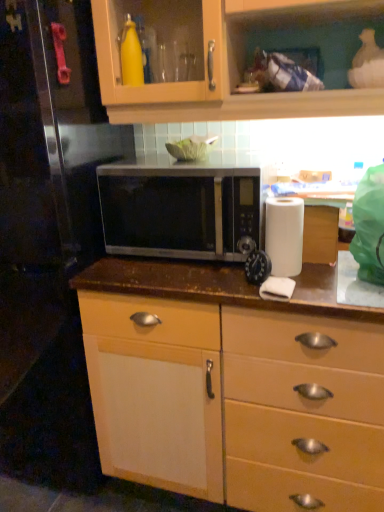
What do you see at coordinates (284, 234) in the screenshot? I see `white matte paper towel at right` at bounding box center [284, 234].

Describe the element at coordinates (233, 388) in the screenshot. The image size is (384, 512). I see `brown polished wood countertop at center` at that location.

This screenshot has width=384, height=512. What do you see at coordinates (257, 267) in the screenshot?
I see `black plastic clock at center` at bounding box center [257, 267].

Locate an element on the screen. satin silver microwave at center is located at coordinates (179, 211).

Locate an element on the screen. The height and width of the screenshot is (512, 384). white matte paper towel at right is located at coordinates (284, 234).

From a real-world perspective, is brown polished wood countertop at center below black plastic clock at center?

Yes, from a real-world perspective, brown polished wood countertop at center is under black plastic clock at center.

In the image, is brown polished wood countertop at center positioned in front of or behind black plastic clock at center?

Visually, brown polished wood countertop at center is located in front of black plastic clock at center.

Would you say brown polished wood countertop at center is to the left or to the right of black plastic clock at center in the picture?

brown polished wood countertop at center is to the right of black plastic clock at center.

Is brown polished wood countertop at center not within black plastic clock at center?

Yes.

From a real-world perspective, is white matte paper towel at right above or below satin silver microwave at center?

white matte paper towel at right is situated lower than satin silver microwave at center in the real world.

Is white matte paper towel at right facing towards satin silver microwave at center?

No.

In terms of width, does white matte paper towel at right look wider or thinner when compared to satin silver microwave at center?

Considering their sizes, white matte paper towel at right looks slimmer than satin silver microwave at center.

Between point (301, 206) and point (134, 210), which one is positioned in front?

Positioned in front is point (301, 206).

Does black plastic clock at center turn towards brown polished wood countertop at center?

No, black plastic clock at center is not aimed at brown polished wood countertop at center.

Considering the sizes of objects black plastic clock at center and brown polished wood countertop at center in the image provided, who is shorter, black plastic clock at center or brown polished wood countertop at center?

black plastic clock at center.

Looking at this image, between black plastic clock at center and brown polished wood countertop at center, which one has larger size?

Bigger between the two is brown polished wood countertop at center.

Is black plastic clock at center aimed at white matte paper towel at right?

No, black plastic clock at center is not facing towards white matte paper towel at right.

From the picture: Which object is further away from the camera taking this photo, black plastic clock at center or white matte paper towel at right?

white matte paper towel at right is more distant.

Is white matte paper towel at right a part of black plastic clock at center?

No, white matte paper towel at right is not surrounded by black plastic clock at center.

Based on their positions, is black plastic clock at center located to the left or right of white matte paper towel at right?

black plastic clock at center is to the left of white matte paper towel at right.

Is white matte paper towel at right not close to brown polished wood countertop at center?

Actually, white matte paper towel at right and brown polished wood countertop at center are a little close together.

In terms of height, does white matte paper towel at right look taller or shorter compared to brown polished wood countertop at center?

white matte paper towel at right is shorter than brown polished wood countertop at center.

Can you confirm if white matte paper towel at right is wider than brown polished wood countertop at center?

Incorrect, the width of white matte paper towel at right does not surpass that of brown polished wood countertop at center.

Based on the photo, between white matte paper towel at right and brown polished wood countertop at center, which one appears on the right side from the viewer's perspective?

From the viewer's perspective, white matte paper towel at right appears more on the right side.

From a real-world perspective, which object stands above the other?

In real-world perspective, satin silver microwave at center is above.

Does satin silver microwave at center have a lesser width compared to white matte paper towel at right?

No.

Considering their positions, is satin silver microwave at center located in front of or behind white matte paper towel at right?

Clearly, satin silver microwave at center is behind white matte paper towel at right.

From a real-world perspective, is white matte paper towel at right physically located above or below black plastic clock at center?

From a real-world perspective, white matte paper towel at right is physically above black plastic clock at center.

Which object is positioned more to the right, white matte paper towel at right or black plastic clock at center?

white matte paper towel at right.

How many degrees apart are the facing directions of white matte paper towel at right and black plastic clock at center?

6.94 degrees separate the facing orientations of white matte paper towel at right and black plastic clock at center.

Is white matte paper towel at right turned away from black plastic clock at center?

That's not correct — white matte paper towel at right is not looking away from black plastic clock at center.

Locate an element on the screen. The width and height of the screenshot is (384, 512). countertop in front of the black plastic clock at center is located at coordinates (233, 388).

Find the location of a particular element. This screenshot has width=384, height=512. paper towel on the right of satin silver microwave at center is located at coordinates (284, 234).

Estimate the real-world distances between objects in this image. Which object is closer to black plastic clock at center, satin silver microwave at center or white matte paper towel at right?

white matte paper towel at right lies closer to black plastic clock at center than the other object.

Estimate the real-world distances between objects in this image. Which object is closer to white matte paper towel at right, brown polished wood countertop at center or satin silver microwave at center?

Among the two, satin silver microwave at center is located nearer to white matte paper towel at right.

Estimate the real-world distances between objects in this image. Which object is closer to satin silver microwave at center, brown polished wood countertop at center or black plastic clock at center?

black plastic clock at center is positioned closer to the anchor satin silver microwave at center.

Considering their positions, is black plastic clock at center positioned further to brown polished wood countertop at center than satin silver microwave at center?

The object further to brown polished wood countertop at center is black plastic clock at center.

Considering their positions, is brown polished wood countertop at center positioned closer to satin silver microwave at center than white matte paper towel at right?

Based on the image, white matte paper towel at right appears to be nearer to satin silver microwave at center.

Considering their positions, is brown polished wood countertop at center positioned further to black plastic clock at center than white matte paper towel at right?

The object further to black plastic clock at center is brown polished wood countertop at center.

Estimate the real-world distances between objects in this image. Which object is further from black plastic clock at center, white matte paper towel at right or brown polished wood countertop at center?

brown polished wood countertop at center is positioned further to the anchor black plastic clock at center.

Which object lies nearer to the anchor point white matte paper towel at right, brown polished wood countertop at center or black plastic clock at center?

The object closer to white matte paper towel at right is black plastic clock at center.

Where is `appliance between satin silver microwave at center and brown polished wood countertop at center in the up-down direction`? appliance between satin silver microwave at center and brown polished wood countertop at center in the up-down direction is located at coordinates (257, 267).

Where is `appliance between white matte paper towel at right and brown polished wood countertop at center in the up-down direction`? The width and height of the screenshot is (384, 512). appliance between white matte paper towel at right and brown polished wood countertop at center in the up-down direction is located at coordinates (257, 267).

Identify the location of appliance between satin silver microwave at center and white matte paper towel at right in the horizontal direction. pyautogui.click(x=257, y=267).

Where is `paper towel between satin silver microwave at center and brown polished wood countertop at center from top to bottom`? This screenshot has height=512, width=384. paper towel between satin silver microwave at center and brown polished wood countertop at center from top to bottom is located at coordinates (284, 234).